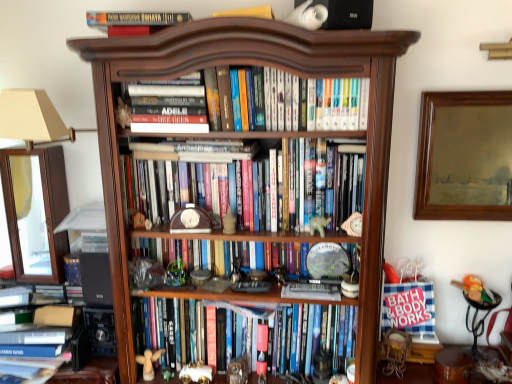
Question: In the image, is hardcover book at center, acting as the 1th book starting from the bottom, on the left side or the right side of hardcover books at center, the 2th book viewed from the top?

Choices:
 (A) right
 (B) left

Answer: (B)

Question: Is hardcover book at center, acting as the 1th book starting from the bottom, wider or thinner than hardcover books at center, the 2th book viewed from the top?

Choices:
 (A) wide
 (B) thin

Answer: (B)

Question: Estimate the real-world distances between objects in this image. Which object is farther from the dark wood bookcase at center?

Choices:
 (A) wooden clock at center, marked as the 2th book in a bottom-to-top arrangement
 (B) white paper at lower right
 (C) white matte bear at center, which is the third toy from top to bottom
 (D) hardcover book at center, acting as the 1th book starting from the bottom
 (E) matte white figurine at center, arranged as the 7th toy when viewed from the left

Answer: (E)

Question: Which object is positioned closest to the matte brown vase at center, positioned as the sixth toy in bottom-to-top order?

Choices:
 (A) white paper at lower right
 (B) white plush toy at lower center, the 1th toy ordered from the bottom
 (C) hardcover books at center, the 2th book viewed from the top
 (D) hardcover books at center, the third book in the bottom-to-top sequence
 (E) brown wooden clock at center

Answer: (E)